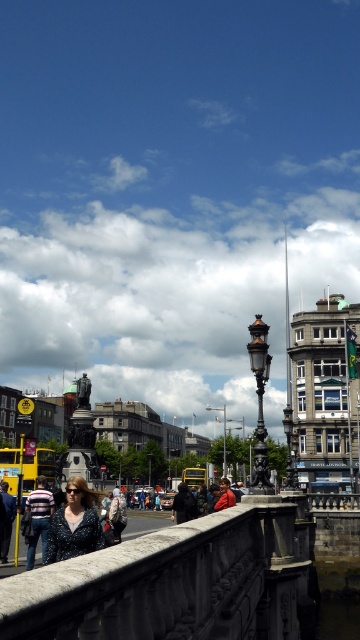
What is the 2D coordinate of the matte black blouse at lower left in the image?

The 2D coordinate of the matte black blouse at lower left is at point (74, 524).

You are a photographer standing on a bridge and want to capture a photo of the denim jacket at lower center without the stone textured rail at center blocking the view. How should you adjust your position?

Move your position downward so that the denim jacket at lower center is no longer blocked by the stone textured rail at center which is above it.

You are a delivery person trying to pass through the area between the stone textured rail at center and the denim jacket at lower center. Based on their widths, can you estimate if there is enough space for your 1.2 meter wide cart?

The stone textured rail at center might be wider than denim jacket at lower center, so the total width required for both objects might exceed the 1.2 meter width of your cart. It is uncertain if there will be enough space, so proceed with caution.